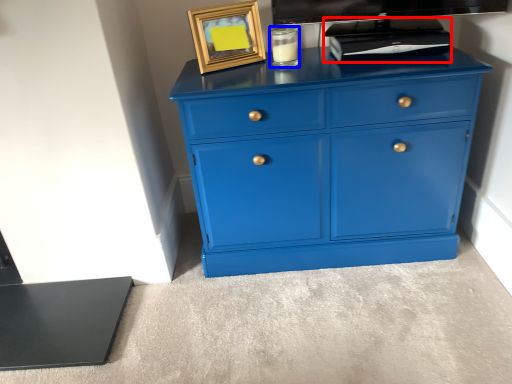
Question: Among these objects, which one is farthest to the camera, appliance (highlighted by a red box) or candle holder (highlighted by a blue box)?

Choices:
 (A) appliance
 (B) candle holder

Answer: (B)